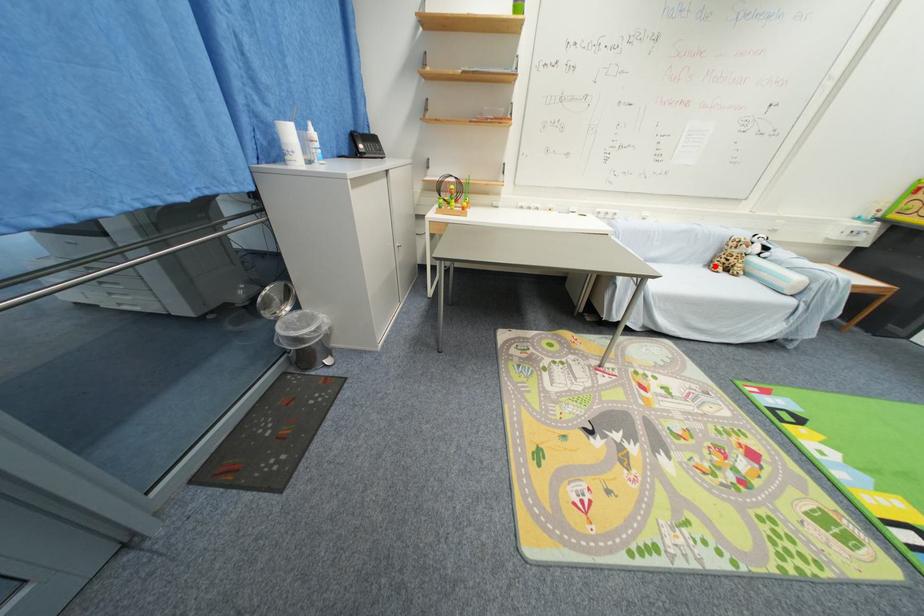
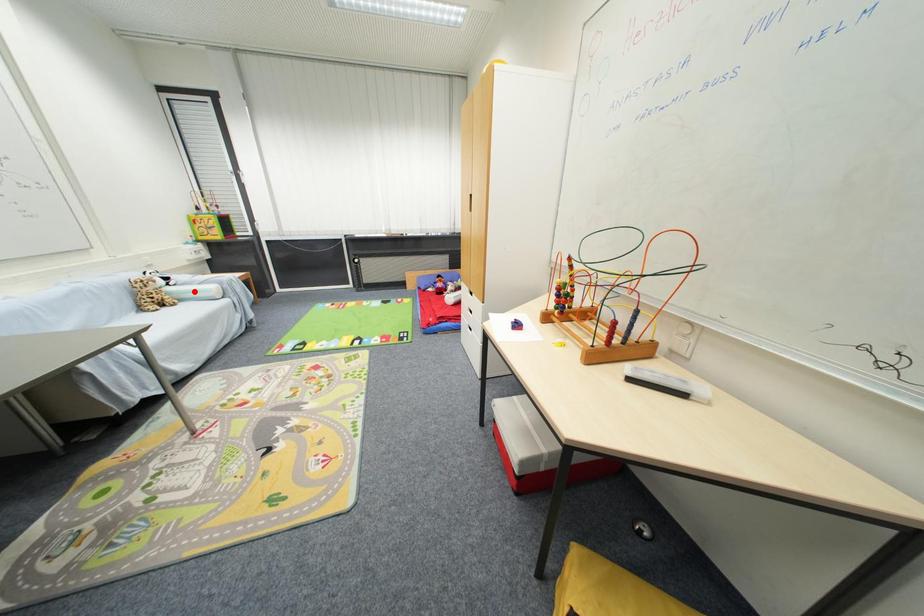
I am providing you with two images of the same scene from different viewpoints. A red point is marked on the first image and another point is marked on the second image. Is the red point in image1 aligned with the point shown in image2?

No